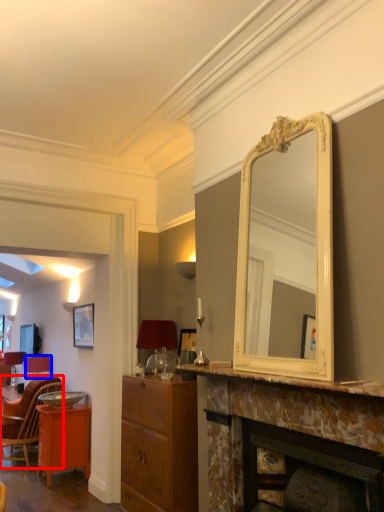
Question: Which of the following is the closest to the observer, chair (highlighted by a red box) or lamp (highlighted by a blue box)?

Choices:
 (A) chair
 (B) lamp

Answer: (A)